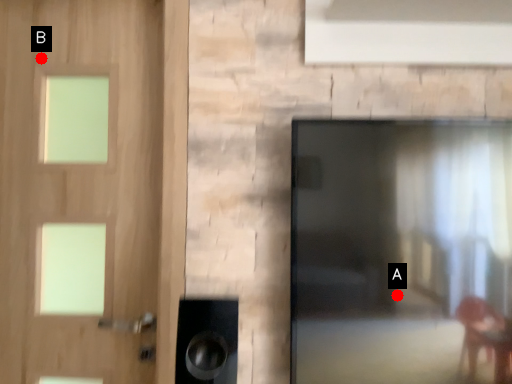
Question: Two points are circled on the image, labeled by A and B beside each circle. Which point is further to the camera?

Choices:
 (A) A is further
 (B) B is further

Answer: (B)